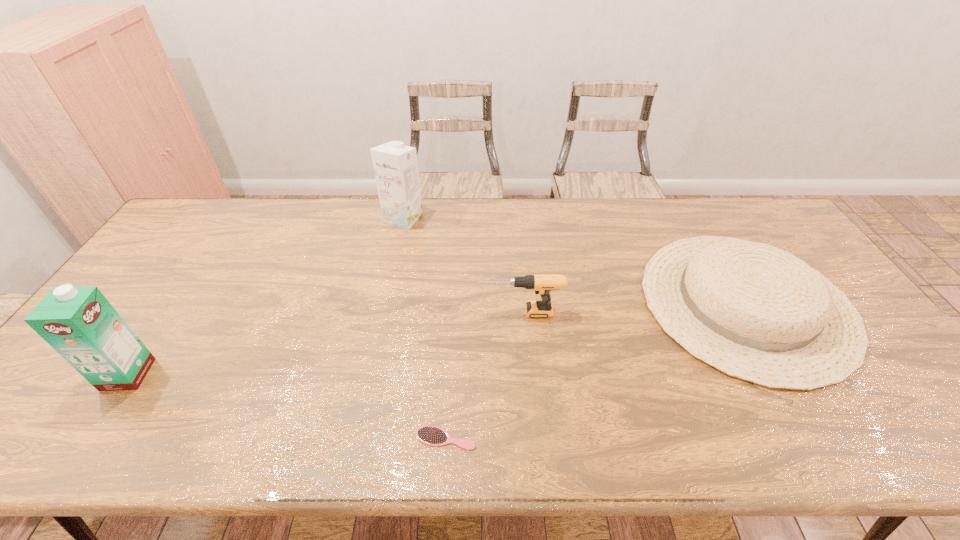
You are a GUI agent. You are given a task and a screenshot of the screen. Output one action in this format:
    pyautogui.click(x=<x>, y=<y>)
    Task: Click on the right carton
    Image resolution: width=960 pixels, height=540 pixels.
    Given the screenshot: What is the action you would take?
    pyautogui.click(x=395, y=165)

Where is `the farther carton`? Image resolution: width=960 pixels, height=540 pixels. the farther carton is located at coordinates (395, 165).

Image resolution: width=960 pixels, height=540 pixels. In order to click on the leftmost object in this screenshot , I will do coord(79,323).

The width and height of the screenshot is (960, 540). In order to click on the left carton in this screenshot , I will do `click(79, 323)`.

This screenshot has width=960, height=540. Find the location of `the fourth object from left to right`. the fourth object from left to right is located at coordinates (542, 284).

Where is `the third tallest object`? The width and height of the screenshot is (960, 540). the third tallest object is located at coordinates (542, 284).

What are the coordinates of `the rightmost object` in the screenshot? It's located at (755, 312).

This screenshot has width=960, height=540. I want to click on sunhat, so click(755, 312).

Identify the location of the shortest object. The height and width of the screenshot is (540, 960). (430, 435).

Find the location of a particular element. The image size is (960, 540). hairbrush is located at coordinates (430, 435).